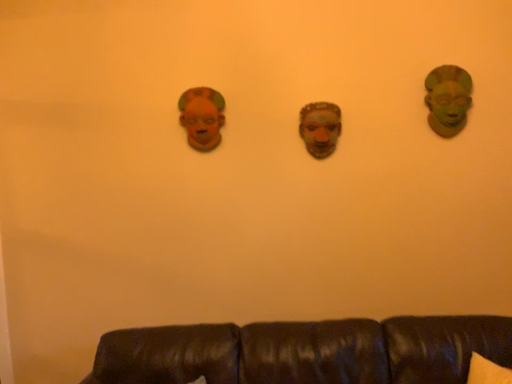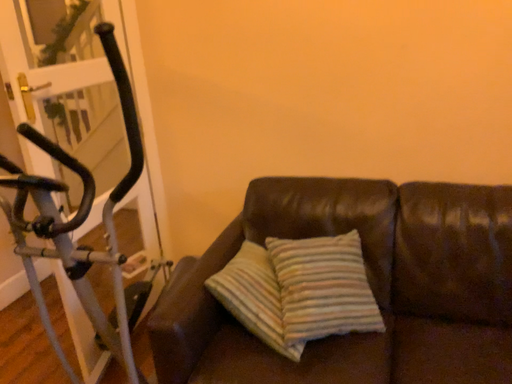
Question: How did the camera likely rotate when shooting the video?

Choices:
 (A) rotated upward
 (B) rotated downward

Answer: (B)